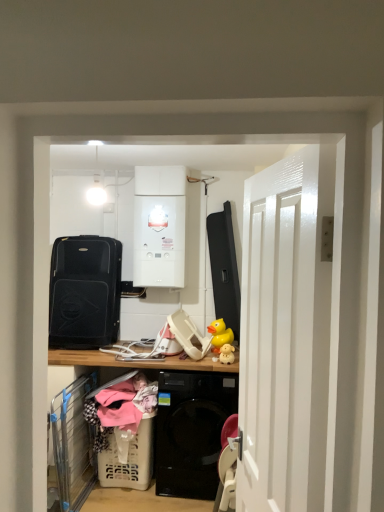
What do you see at coordinates (84, 292) in the screenshot? The width and height of the screenshot is (384, 512). I see `black matte suitcase at left, which appears as the first appliance when viewed from the left` at bounding box center [84, 292].

I want to click on white plastic laundry basket at lower left, so click(x=136, y=361).

Can you confirm if white glossy door at right is shorter than yellow rubber duck at center?

Incorrect, the height of white glossy door at right does not fall short of that of yellow rubber duck at center.

Which object is closer to the camera, white glossy door at right or yellow rubber duck at center?

white glossy door at right is more forward.

Which of these two, white glossy door at right or yellow rubber duck at center, is wider?

With larger width is yellow rubber duck at center.

Image resolution: width=384 pixels, height=512 pixels. Find the location of `cabinetry lying in front of the plastic laundry basket at lower center`. cabinetry lying in front of the plastic laundry basket at lower center is located at coordinates (136, 361).

Is white plastic laundry basket at lower left far from plastic laundry basket at lower center?

No, there isn't a large distance between white plastic laundry basket at lower left and plastic laundry basket at lower center.

Between white plastic laundry basket at lower left and plastic laundry basket at lower center, which one is positioned behind?

plastic laundry basket at lower center is further from the camera.

From the image's perspective, which one is positioned lower, white plastic laundry basket at lower left or plastic laundry basket at lower center?

plastic laundry basket at lower center is shown below in the image.

Is black matte suitcase at left, arranged as the 2th appliance when viewed from the right, to the right of white glossy door at right from the viewer's perspective?

Incorrect, black matte suitcase at left, arranged as the 2th appliance when viewed from the right, is not on the right side of white glossy door at right.

Is white glossy door at right surrounded by black matte suitcase at left, which appears as the first appliance when viewed from the left?

No.

From the image's perspective, relative to white glossy door at right, is black matte suitcase at left, arranged as the 2th appliance when viewed from the right, above or below?

black matte suitcase at left, arranged as the 2th appliance when viewed from the right, is above white glossy door at right.

Does plastic laundry basket at lower center have a greater height compared to white glossy door at right?

No.

Where is `basket below the white glossy door at right (from a real-world perspective)`? Image resolution: width=384 pixels, height=512 pixels. basket below the white glossy door at right (from a real-world perspective) is located at coordinates (129, 460).

Is plastic laundry basket at lower center facing away from white glossy door at right?

No, plastic laundry basket at lower center is not facing away from white glossy door at right.

Find the location of a particular element. appliance on the right of black matte suitcase at left, arranged as the 2th appliance when viewed from the right is located at coordinates (159, 241).

Based on the photo, is white glossy boiler at upper center, which appears as the second appliance when viewed from the left, touching black matte suitcase at left, which appears as the first appliance when viewed from the left?

white glossy boiler at upper center, which appears as the second appliance when viewed from the left, is not next to black matte suitcase at left, which appears as the first appliance when viewed from the left, and they're not touching.

From a real-world perspective, is white glossy boiler at upper center, acting as the first appliance starting from the right, under black matte suitcase at left, which appears as the first appliance when viewed from the left?

Actually, white glossy boiler at upper center, acting as the first appliance starting from the right, is physically above black matte suitcase at left, which appears as the first appliance when viewed from the left, in the real world.

Is white glossy boiler at upper center, acting as the first appliance starting from the right, bigger than black matte suitcase at left, arranged as the 2th appliance when viewed from the right?

No, white glossy boiler at upper center, acting as the first appliance starting from the right, is not bigger than black matte suitcase at left, arranged as the 2th appliance when viewed from the right.

Which object is closer to the camera taking this photo, white plastic laundry basket at lower left or black matte suitcase at left, which appears as the first appliance when viewed from the left?

white plastic laundry basket at lower left is in front.

Does white plastic laundry basket at lower left have a smaller size compared to black matte suitcase at left, arranged as the 2th appliance when viewed from the right?

No, white plastic laundry basket at lower left is not smaller than black matte suitcase at left, arranged as the 2th appliance when viewed from the right.

Which is further, (x=187, y=369) or (x=94, y=311)?

The point (x=94, y=311) is behind.

Does white plastic laundry basket at lower left have a greater height compared to black matte suitcase at left, arranged as the 2th appliance when viewed from the right?

Indeed, white plastic laundry basket at lower left has a greater height compared to black matte suitcase at left, arranged as the 2th appliance when viewed from the right.

Which object is positioned more to the left, plastic laundry basket at lower center or white glossy boiler at upper center, acting as the first appliance starting from the right?

plastic laundry basket at lower center.

Is plastic laundry basket at lower center in front of white glossy boiler at upper center, acting as the first appliance starting from the right?

Yes, plastic laundry basket at lower center is closer to the viewer.

Does plastic laundry basket at lower center turn towards white glossy boiler at upper center, which appears as the second appliance when viewed from the left?

No, plastic laundry basket at lower center is not facing towards white glossy boiler at upper center, which appears as the second appliance when viewed from the left.

Looking at this image, who is smaller, plastic laundry basket at lower center or white glossy boiler at upper center, which appears as the second appliance when viewed from the left?

Smaller between the two is plastic laundry basket at lower center.

Find the location of `toy lying on the left of white glossy door at right`. toy lying on the left of white glossy door at right is located at coordinates (220, 334).

Locate an element on the screen. This screenshot has height=512, width=384. basket below the white plastic laundry basket at lower left (from the image's perspective) is located at coordinates (129, 460).

Based on their spatial positions, is white glossy door at right or plastic laundry basket at lower center closer to yellow rubber duck at center?

Based on the image, plastic laundry basket at lower center appears to be nearer to yellow rubber duck at center.

Estimate the real-world distances between objects in this image. Which object is closer to black matte suitcase at left, which appears as the first appliance when viewed from the left, yellow rubber duck at center or white glossy boiler at upper center, which appears as the second appliance when viewed from the left?

Among the two, white glossy boiler at upper center, which appears as the second appliance when viewed from the left, is located nearer to black matte suitcase at left, which appears as the first appliance when viewed from the left.

Looking at the image, which one is located closer to black matte suitcase at left, which appears as the first appliance when viewed from the left, white glossy door at right or plastic laundry basket at lower center?

plastic laundry basket at lower center.

Estimate the real-world distances between objects in this image. Which object is further from white plastic laundry basket at lower left, black matte suitcase at left, which appears as the first appliance when viewed from the left, or white glossy door at right?

white glossy door at right is further to white plastic laundry basket at lower left.

Estimate the real-world distances between objects in this image. Which object is further from white glossy door at right, black matte suitcase at left, arranged as the 2th appliance when viewed from the right, or plastic laundry basket at lower center?

Based on the image, black matte suitcase at left, arranged as the 2th appliance when viewed from the right, appears to be further to white glossy door at right.

When comparing their distances from plastic laundry basket at lower center, does white plastic laundry basket at lower left or yellow rubber duck at center seem further?

yellow rubber duck at center is positioned further to the anchor plastic laundry basket at lower center.

Consider the image. Considering their positions, is black matte suitcase at left, which appears as the first appliance when viewed from the left, positioned further to white plastic laundry basket at lower left than white glossy boiler at upper center, which appears as the second appliance when viewed from the left?

white glossy boiler at upper center, which appears as the second appliance when viewed from the left, is further to white plastic laundry basket at lower left.

Looking at the image, which one is located closer to white glossy door at right, black matte suitcase at left, which appears as the first appliance when viewed from the left, or yellow rubber duck at center?

yellow rubber duck at center is positioned closer to the anchor white glossy door at right.

Locate an element on the screen. This screenshot has height=512, width=384. cabinetry positioned between white glossy door at right and white glossy boiler at upper center, acting as the first appliance starting from the right, from near to far is located at coordinates (136, 361).

Identify the location of basket between white glossy door at right and white glossy boiler at upper center, acting as the first appliance starting from the right, in the front-back direction. (129, 460).

Locate an element on the screen. basket between white glossy door at right and black matte suitcase at left, arranged as the 2th appliance when viewed from the right, from front to back is located at coordinates (129, 460).

Locate an element on the screen. basket between white glossy door at right and yellow rubber duck at center from front to back is located at coordinates (129, 460).